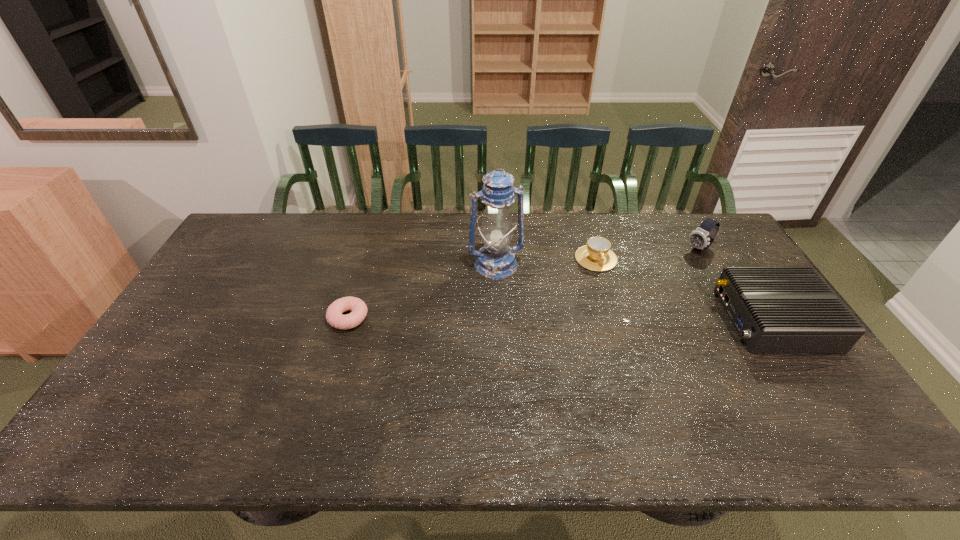
Where is `doughnut`? The width and height of the screenshot is (960, 540). doughnut is located at coordinates (334, 316).

The height and width of the screenshot is (540, 960). What are the coordinates of `the leftmost object` in the screenshot? It's located at (334, 316).

Where is `the third tallest object`? the third tallest object is located at coordinates (775, 309).

In order to click on lantern in this screenshot , I will do `click(495, 260)`.

Locate an element on the screen. the fourth object from right to left is located at coordinates (495, 260).

The width and height of the screenshot is (960, 540). I want to click on cup, so click(x=596, y=255).

Where is `the third object from left to right`? the third object from left to right is located at coordinates (596, 255).

Where is `watch`? The image size is (960, 540). watch is located at coordinates (701, 238).

This screenshot has height=540, width=960. Find the location of `vacant space located 0.280m on the right of the doughnut`. vacant space located 0.280m on the right of the doughnut is located at coordinates (464, 318).

The width and height of the screenshot is (960, 540). In order to click on free space located 0.300m on the back panel of the router in this screenshot , I will do `click(620, 320)`.